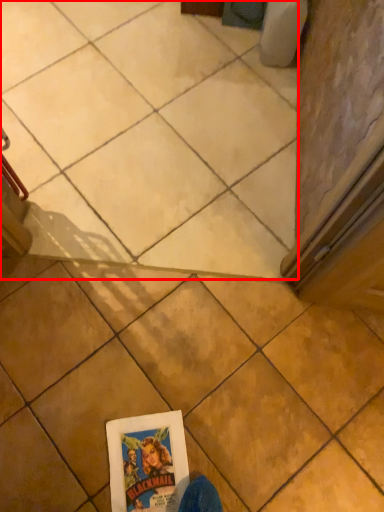
Question: In this image, where is tile (annotated by the red box) located relative to tile?

Choices:
 (A) right
 (B) left

Answer: (B)